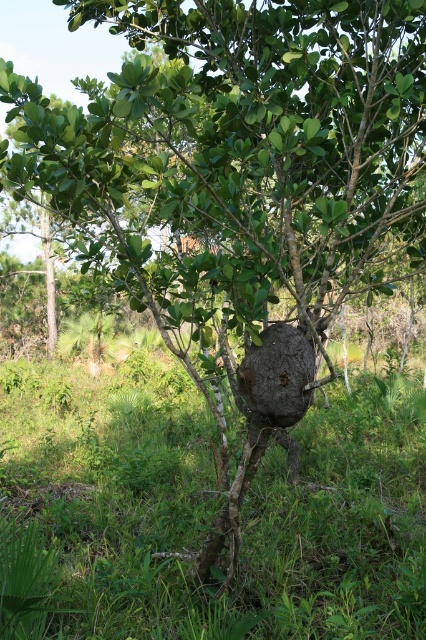
Based on the photo, you are standing at the base of the tree and want to place a small decorative stone on the green grass at lower center. According to the coordinates provided, where should you place the stone relative to the tree?

The green grass at lower center is located at point (206, 513), so you should place the stone at those coordinates relative to the tree.

You are a gardener who wants to plant a new flower bed between the green grass at lower center and the brown rough rock at center. Based on their positions, where should you place the flower bed so it is between both objects?

The flower bed should be placed between the green grass at lower center and the brown rough rock at center, as the green grass at lower center is located below the brown rough rock at center.

You are a gardener trying to water the green grass at lower center and the brown rough rock at center. Which object should you water first if you want to reach the one closer to you first?

The green grass at lower center is in front of the brown rough rock at center, so you should water the green grass at lower center first since it is closer to you.